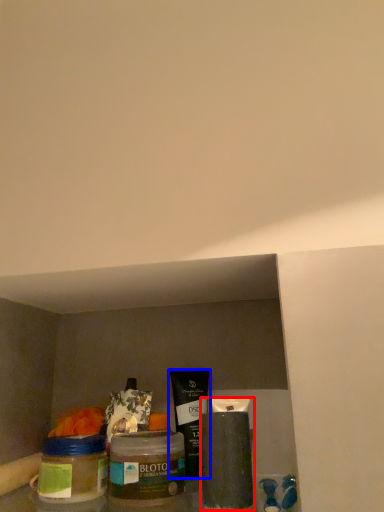
Question: Which of the following is the closest to the observer, cleaning product (highlighted by a red box) or product (highlighted by a blue box)?

Choices:
 (A) cleaning product
 (B) product

Answer: (A)